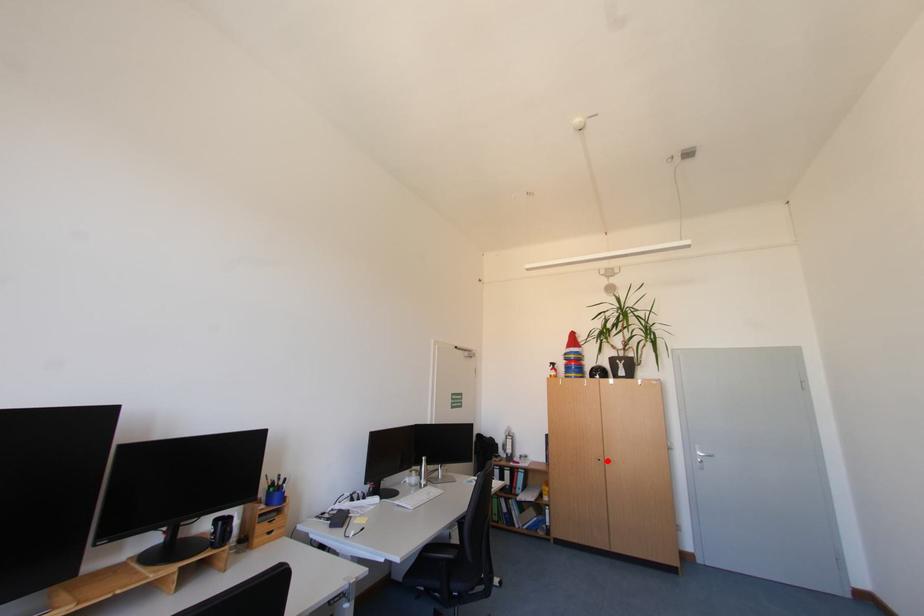
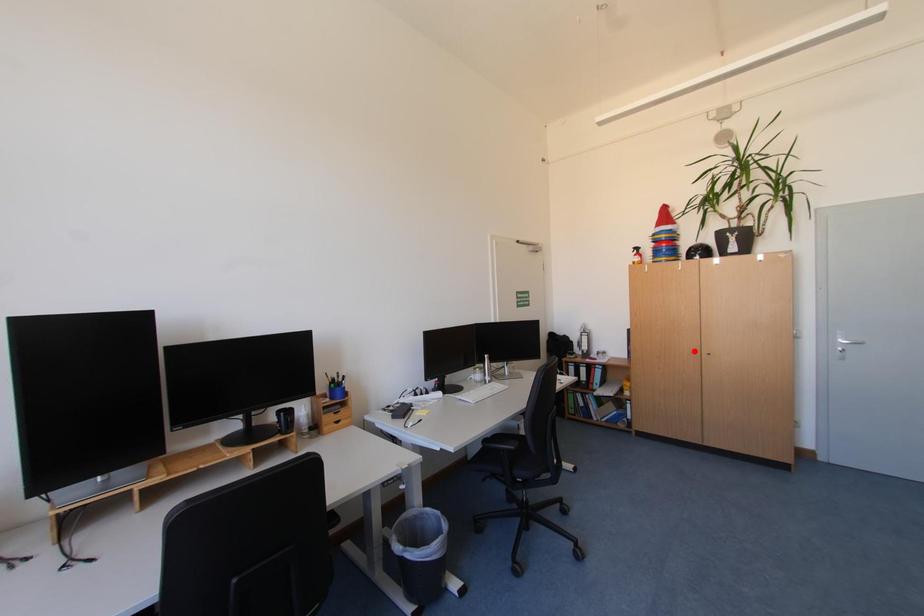
I am providing you with two images of the same scene from different viewpoints. A red point is marked on the first image and another point is marked on the second image. Is the marked point in image1 the same physical position as the marked point in image2?

No